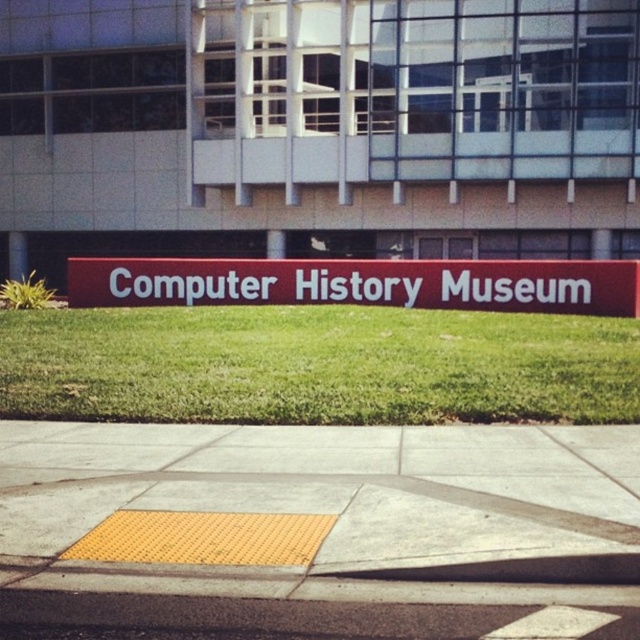
Question: Which of the following is the closest to the observer?

Choices:
 (A) yellow textured pavement at center
 (B) green grass at center
 (C) red matte sign at center

Answer: (A)

Question: Which point is closer to the camera?

Choices:
 (A) yellow textured pavement at center
 (B) green grass at center
 (C) red matte sign at center

Answer: (A)

Question: Considering the relative positions of yellow textured pavement at center and red matte sign at center in the image provided, where is yellow textured pavement at center located with respect to red matte sign at center?

Choices:
 (A) above
 (B) below

Answer: (B)

Question: Which point is closer to the camera?

Choices:
 (A) (387, 262)
 (B) (339, 368)
 (C) (465, 509)

Answer: (C)

Question: Does yellow textured pavement at center appear under red matte sign at center?

Choices:
 (A) yes
 (B) no

Answer: (A)

Question: Does yellow textured pavement at center appear over red matte sign at center?

Choices:
 (A) yes
 (B) no

Answer: (B)